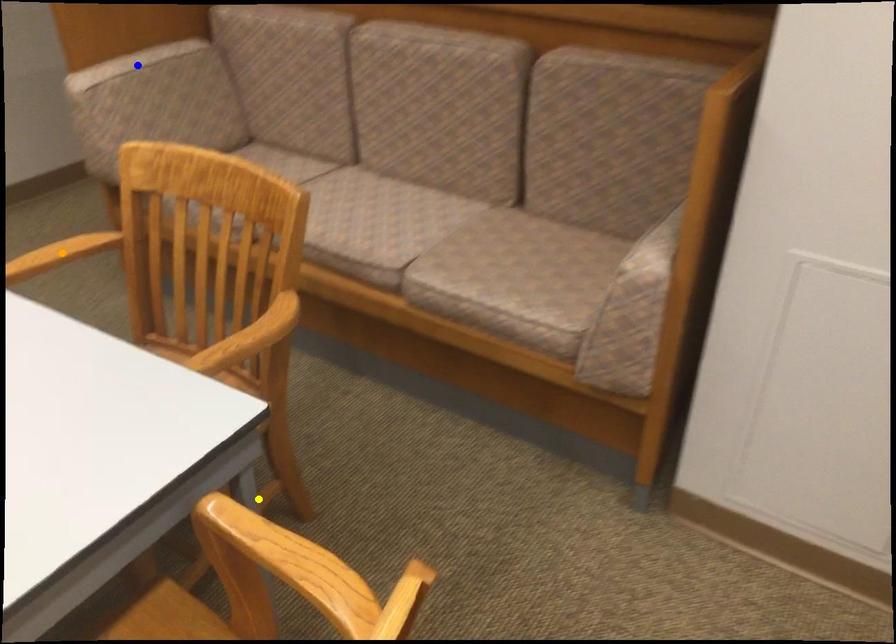
Order these from nearest to farthest:
blue point | yellow point | orange point

yellow point → orange point → blue point